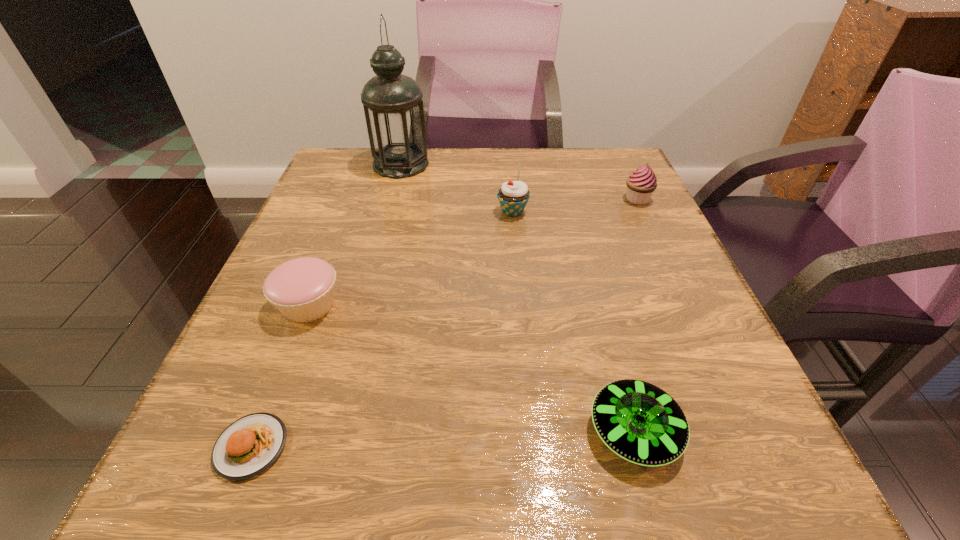
Find the location of a particular element. free location that satisfies the following two spatial constraints: 1. on the back side of the fourth object from left to right; 2. on the left side of the food is located at coordinates (344, 212).